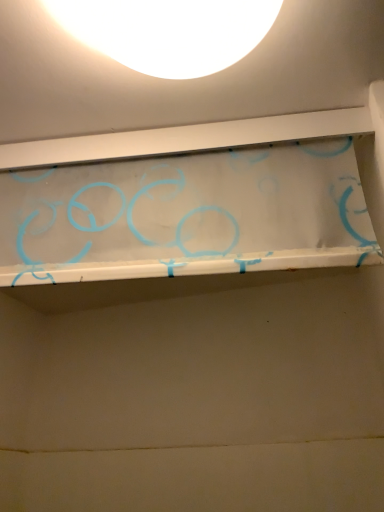
Question: Is point 182,7 positioned closer to the camera than point 210,219?

Choices:
 (A) farther
 (B) closer

Answer: (B)

Question: Considering their positions, is white matte lampshade at upper center located in front of or behind transparent plastic shelf at upper center?

Choices:
 (A) front
 (B) behind

Answer: (A)

Question: Visually, is white matte lampshade at upper center positioned to the left or to the right of transparent plastic shelf at upper center?

Choices:
 (A) right
 (B) left

Answer: (A)

Question: Does point (48, 220) appear closer or farther from the camera than point (125, 27)?

Choices:
 (A) farther
 (B) closer

Answer: (A)

Question: Is transparent plastic shelf at upper center in front of or behind white matte lampshade at upper center in the image?

Choices:
 (A) front
 (B) behind

Answer: (B)

Question: Considering the positions of transparent plastic shelf at upper center and white matte lampshade at upper center in the image, is transparent plastic shelf at upper center wider or thinner than white matte lampshade at upper center?

Choices:
 (A) thin
 (B) wide

Answer: (A)

Question: From the image's perspective, is transparent plastic shelf at upper center positioned above or below white matte lampshade at upper center?

Choices:
 (A) below
 (B) above

Answer: (A)